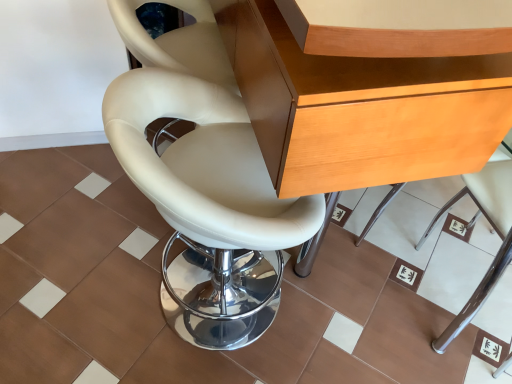
Question: From the image's perspective, is white leather chair at lower right, which is the first chair from right to left, over white leather chair at center, which appears as the 2th chair when viewed from the right?

Choices:
 (A) no
 (B) yes

Answer: (A)

Question: Does white leather chair at lower right, the second chair viewed from the left, have a lesser width compared to white leather chair at center, which appears as the 2th chair when viewed from the right?

Choices:
 (A) no
 (B) yes

Answer: (A)

Question: Is white leather chair at lower right, the second chair viewed from the left, further to the viewer compared to white leather chair at center, which appears as the 2th chair when viewed from the right?

Choices:
 (A) yes
 (B) no

Answer: (A)

Question: Is white leather chair at lower right, the second chair viewed from the left, turned away from white leather chair at center, positioned as the first chair in left-to-right order?

Choices:
 (A) no
 (B) yes

Answer: (A)

Question: Is white leather chair at lower right, the second chair viewed from the left, aimed at white leather chair at center, which appears as the 2th chair when viewed from the right?

Choices:
 (A) no
 (B) yes

Answer: (A)

Question: Is white leather chair at lower right, the second chair viewed from the left, not inside white leather chair at center, which appears as the 2th chair when viewed from the right?

Choices:
 (A) no
 (B) yes

Answer: (B)

Question: From the image's perspective, is wooden desk at center above white leather chair at center, which appears as the 2th chair when viewed from the right?

Choices:
 (A) no
 (B) yes

Answer: (B)

Question: Does wooden desk at center have a greater width compared to white leather chair at center, positioned as the first chair in left-to-right order?

Choices:
 (A) no
 (B) yes

Answer: (B)

Question: Can you confirm if wooden desk at center is shorter than white leather chair at center, which appears as the 2th chair when viewed from the right?

Choices:
 (A) yes
 (B) no

Answer: (B)

Question: Can you confirm if wooden desk at center is bigger than white leather chair at center, which appears as the 2th chair when viewed from the right?

Choices:
 (A) no
 (B) yes

Answer: (B)

Question: Is wooden desk at center to the right of white leather chair at center, positioned as the first chair in left-to-right order, from the viewer's perspective?

Choices:
 (A) yes
 (B) no

Answer: (A)

Question: From a real-world perspective, is wooden desk at center positioned under white leather chair at center, which appears as the 2th chair when viewed from the right, based on gravity?

Choices:
 (A) yes
 (B) no

Answer: (B)

Question: Considering the relative sizes of white leather chair at center, positioned as the first chair in left-to-right order, and brown matte tile at center in the image provided, is white leather chair at center, positioned as the first chair in left-to-right order, taller than brown matte tile at center?

Choices:
 (A) no
 (B) yes

Answer: (B)